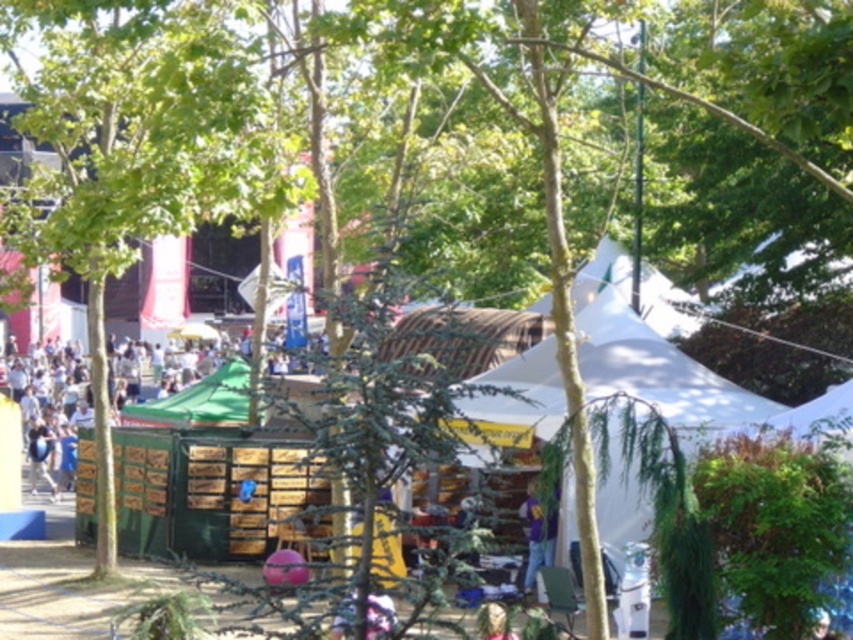
Based on the scene description, where is the green leafy tree at left located in terms of its 2D coordinates?

The green leafy tree at left is located at the 2D coordinates point (136, 148).

You are at the festival and want to find the green canopy tent. You see a point marked at coordinates [136,148] which is the green leafy tree at left. Which direction should you go from the tree to reach the green canopy tent?

The green canopy tent is to the right of the green leafy tree at left marked at point [136,148]. So you should go to the right from the tree to reach the green canopy tent.

You are attending an outdoor festival and notice a green leafy tree at left and a purple matte shirt at lower center. From your vantage point, which object is positioned higher in the scene?

The green leafy tree at left is positioned higher than the purple matte shirt at lower center in the scene.